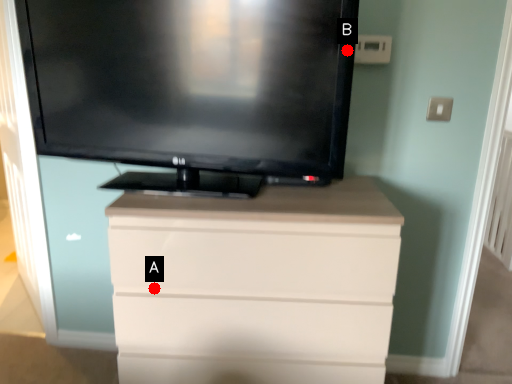
Question: Two points are circled on the image, labeled by A and B beside each circle. Which point is further to the camera?

Choices:
 (A) A is further
 (B) B is further

Answer: (A)